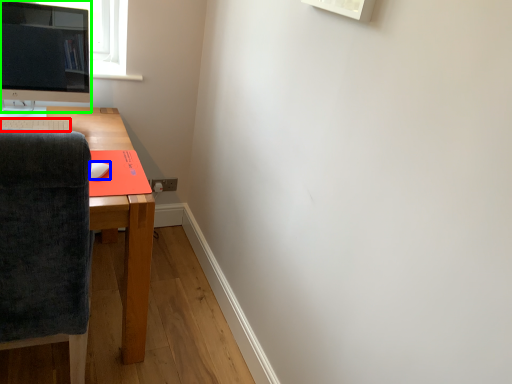
Question: Which object is positioned closest to desktop (highlighted by a red box)? Select from mouse (highlighted by a blue box) and computer monitor (highlighted by a green box).

Choices:
 (A) mouse
 (B) computer monitor

Answer: (A)